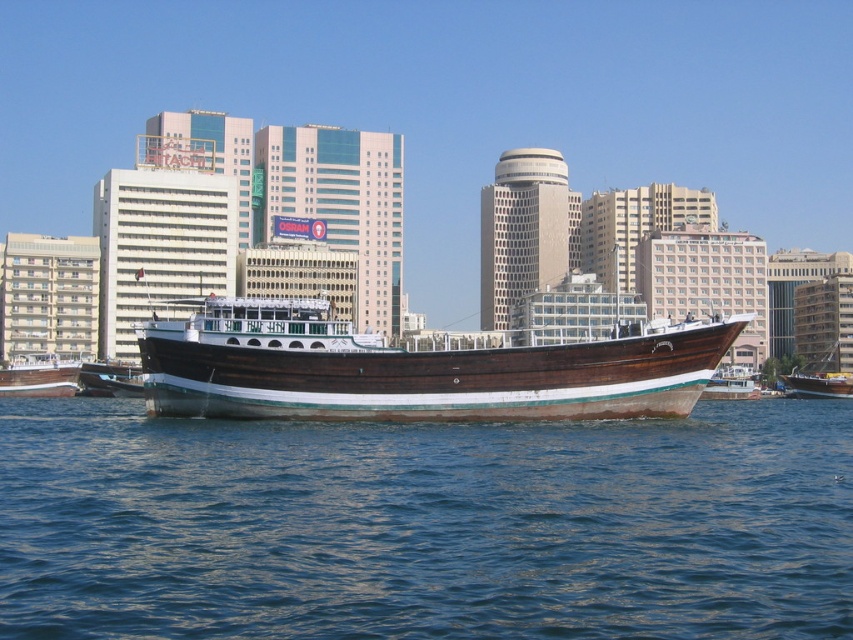
Which of these two, wooden boat at left or wooden polished boat at center, stands shorter?

Standing shorter between the two is wooden polished boat at center.

Can you confirm if wooden boat at left is wider than wooden polished boat at center?

Correct, the width of wooden boat at left exceeds that of wooden polished boat at center.

Does point (59, 396) lie behind point (120, 388)?

Yes.

Locate an element on the screen. Image resolution: width=853 pixels, height=640 pixels. wooden boat at left is located at coordinates (39, 376).

Who is higher up, brown polished wood boat at center or wooden polished boat at center?

brown polished wood boat at center is higher up.

Does brown polished wood boat at center have a larger size compared to wooden polished boat at center?

Yes, brown polished wood boat at center is bigger than wooden polished boat at center.

Between point (604, 378) and point (78, 374), which one is positioned behind?

Positioned behind is point (78, 374).

I want to click on brown polished wood boat at center, so click(409, 369).

Who is higher up, blue water at center or wooden boat at center?

wooden boat at center is higher up.

Which is behind, point (670, 550) or point (824, 396)?

The point (824, 396) is behind.

Image resolution: width=853 pixels, height=640 pixels. In order to click on blue water at center in this screenshot , I will do `click(425, 525)`.